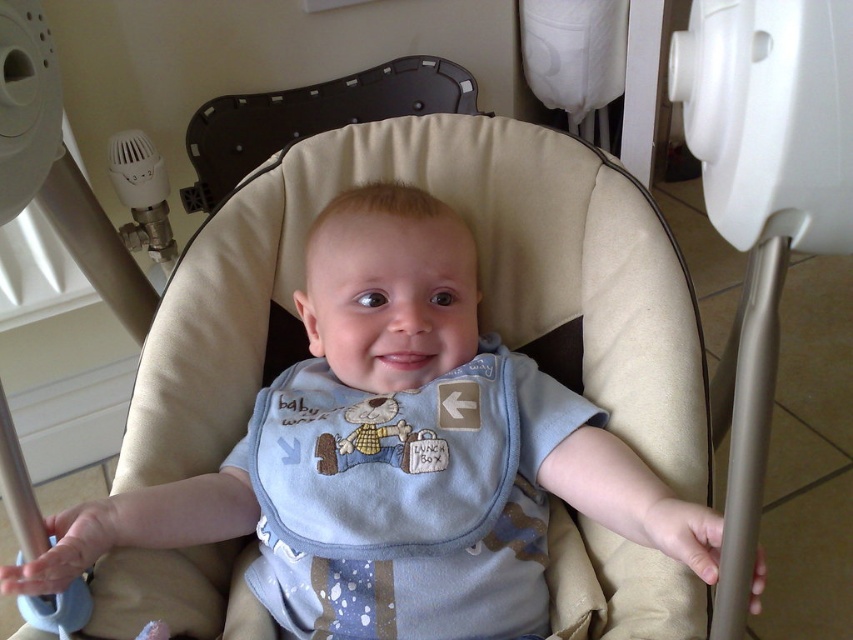
Who is more distant from viewer, [518,596] or [363,93]?

Positioned behind is point [363,93].

Is blue cotton bib at center taller than black plastic feeding chair at upper center?

In fact, blue cotton bib at center may be shorter than black plastic feeding chair at upper center.

This screenshot has width=853, height=640. Identify the location of blue cotton bib at center. (405, 500).

Does light blue fabric bib at center have a lesser width compared to black plastic feeding chair at upper center?

In fact, light blue fabric bib at center might be wider than black plastic feeding chair at upper center.

Does light blue fabric bib at center appear over black plastic feeding chair at upper center?

Actually, light blue fabric bib at center is below black plastic feeding chair at upper center.

Looking at this image, measure the distance between light blue fabric bib at center and camera.

The distance of light blue fabric bib at center from camera is 21.22 inches.

You are a GUI agent. You are given a task and a screenshot of the screen. Output one action in this format:
    pyautogui.click(x=<x>, y=<y>)
    Task: Click on the light blue fabric bib at center
    This screenshot has height=640, width=853.
    Given the screenshot: What is the action you would take?
    (389, 289)

Is blue cotton bib at center wider than light blue fabric bib at center?

Incorrect, blue cotton bib at center's width does not surpass light blue fabric bib at center's.

Who is lower down, blue cotton bib at center or light blue fabric bib at center?

Positioned lower is blue cotton bib at center.

Which is in front, point (532, 538) or point (631, 540)?

Positioned in front is point (631, 540).

Image resolution: width=853 pixels, height=640 pixels. What are the coordinates of `blue cotton bib at center` in the screenshot? It's located at (405, 500).